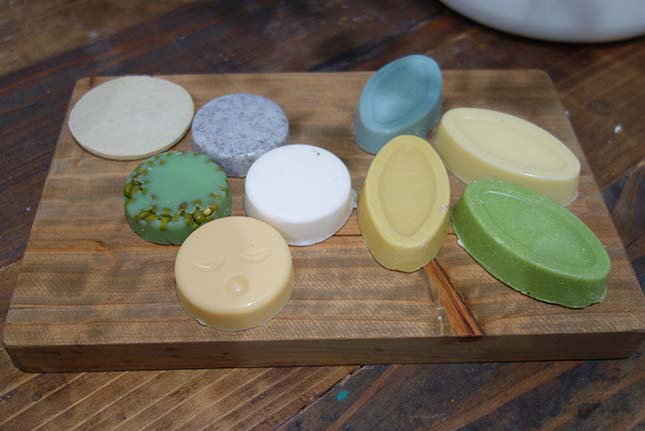
I want to click on soap, so click(x=242, y=285), click(x=309, y=217), click(x=171, y=196), click(x=220, y=150), click(x=150, y=115), click(x=401, y=107), click(x=401, y=191), click(x=502, y=152), click(x=542, y=251).